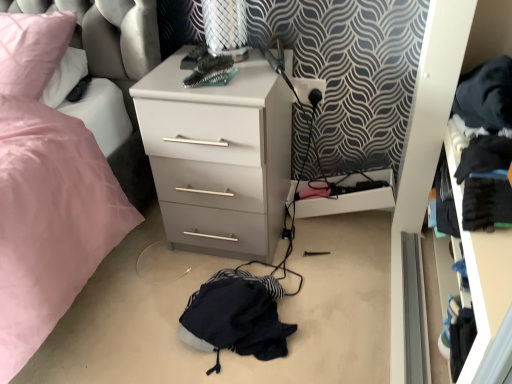
Question: From the image's perspective, is white plastic drawer at lower center positioned above or below pink fabric swivel chair at upper left?

Choices:
 (A) above
 (B) below

Answer: (B)

Question: Is point (309, 215) positioned closer to the camera than point (76, 105)?

Choices:
 (A) closer
 (B) farther

Answer: (B)

Question: Which object is the closest to the black plastic electric outlet at upper right?

Choices:
 (A) black fabric drawer at right
 (B) matte gray chest of drawers at center
 (C) pink fabric swivel chair at upper left
 (D) dark blue fabric at center
 (E) white plastic drawer at lower center

Answer: (E)

Question: Which object is the farthest from the black fabric drawer at right?

Choices:
 (A) pink fabric swivel chair at upper left
 (B) white plastic drawer at lower center
 (C) dark blue fabric at center
 (D) matte gray chest of drawers at center
 (E) black plastic electric outlet at upper right

Answer: (A)